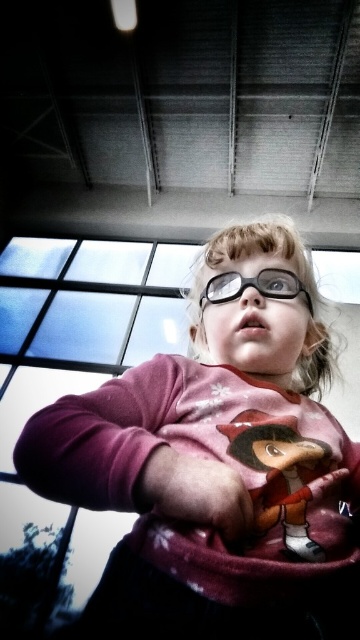
Who is lower down, pink matte sweater at center or pink matte hand at center?

pink matte hand at center is below.

Who is taller, pink matte sweater at center or pink matte hand at center?

pink matte sweater at center

Where is `pink matte sweater at center`? pink matte sweater at center is located at coordinates (217, 468).

The width and height of the screenshot is (360, 640). Find the location of `pink matte sweater at center`. pink matte sweater at center is located at coordinates (217, 468).

Can you confirm if pink matte sweater at center is positioned above matte pink plush toy at center?

Yes.

In the scene shown: Does pink matte sweater at center appear under matte pink plush toy at center?

Incorrect, pink matte sweater at center is not positioned below matte pink plush toy at center.

At what (x,y) coordinates should I click in order to perform the action: click on pink matte sweater at center. Please return your answer as a coordinate pair (x, y). This screenshot has width=360, height=640. Looking at the image, I should click on (217, 468).

Is matte pink plush toy at center bigger than black plastic glasses at center?

Yes.

Consider the image. Which of these two, matte pink plush toy at center or black plastic glasses at center, stands taller?

matte pink plush toy at center is taller.

Between point (244, 435) and point (273, 282), which one is positioned behind?

Positioned behind is point (273, 282).

Locate an element on the screen. matte pink plush toy at center is located at coordinates (289, 480).